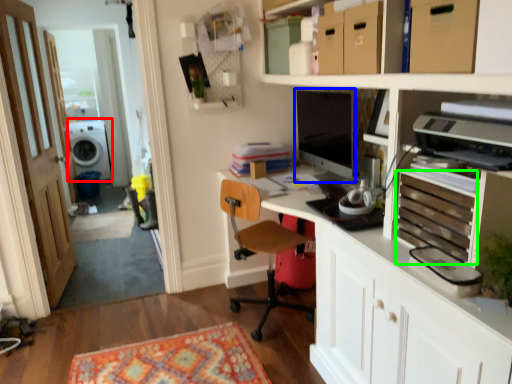
Question: Based on their relative distances, which object is farther from washing machine (highlighted by a red box)? Choose from computer monitor (highlighted by a blue box) and drawer (highlighted by a green box).

Choices:
 (A) computer monitor
 (B) drawer

Answer: (B)